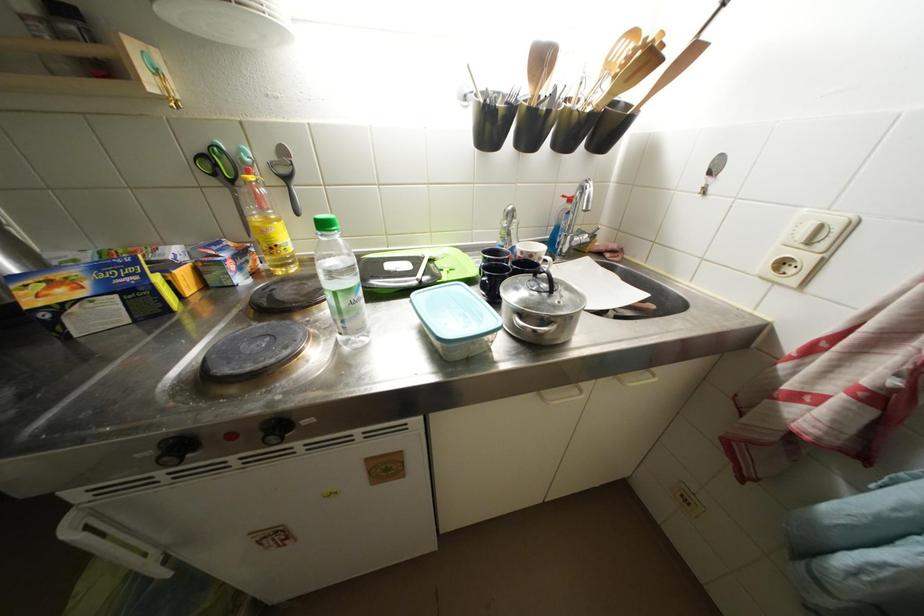
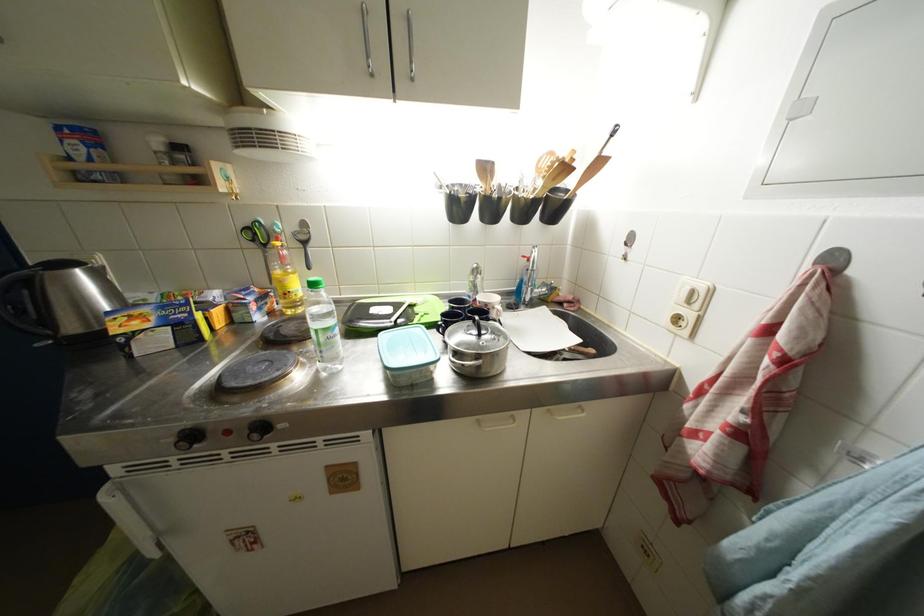
The point at [238,185] is marked in the first image. Where is the corresponding point in the second image?

(272, 249)